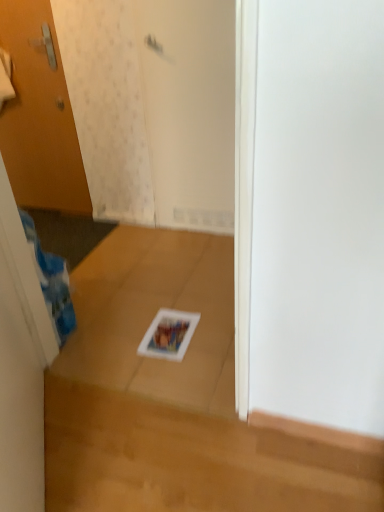
Question: From the image's perspective, is matte white magazine at center located beneath wooden door at left?

Choices:
 (A) yes
 (B) no

Answer: (A)

Question: Considering the relative sizes of matte white magazine at center and wooden door at left in the image provided, is matte white magazine at center wider than wooden door at left?

Choices:
 (A) no
 (B) yes

Answer: (B)

Question: Is matte white magazine at center not near wooden door at left?

Choices:
 (A) no
 (B) yes

Answer: (B)

Question: Does matte white magazine at center have a lesser width compared to wooden door at left?

Choices:
 (A) yes
 (B) no

Answer: (B)

Question: Is matte white magazine at center oriented towards wooden door at left?

Choices:
 (A) no
 (B) yes

Answer: (A)

Question: Is the depth of matte white magazine at center less than that of wooden door at left?

Choices:
 (A) yes
 (B) no

Answer: (A)

Question: Is white matte screen door at upper center thinner than wooden door at left?

Choices:
 (A) yes
 (B) no

Answer: (B)

Question: Is white matte screen door at upper center facing away from wooden door at left?

Choices:
 (A) yes
 (B) no

Answer: (B)

Question: Is white matte screen door at upper center positioned beyond the bounds of wooden door at left?

Choices:
 (A) no
 (B) yes

Answer: (B)

Question: From a real-world perspective, is white matte screen door at upper center located beneath wooden door at left?

Choices:
 (A) no
 (B) yes

Answer: (B)

Question: Considering the relative positions of white matte screen door at upper center and wooden door at left in the image provided, is white matte screen door at upper center to the right of wooden door at left from the viewer's perspective?

Choices:
 (A) no
 (B) yes

Answer: (B)

Question: Can you confirm if white matte screen door at upper center is smaller than wooden door at left?

Choices:
 (A) no
 (B) yes

Answer: (A)

Question: Is wooden door at left behind white matte screen door at upper center?

Choices:
 (A) yes
 (B) no

Answer: (A)